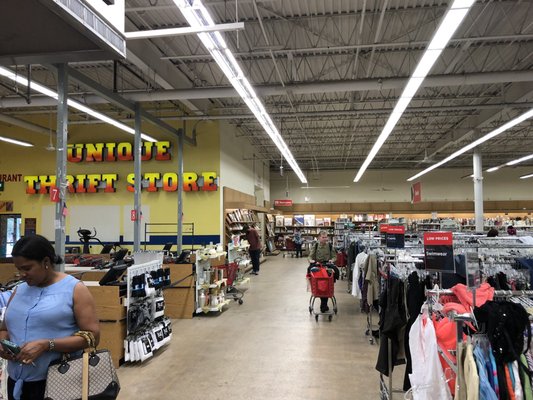
Locate an element on the screen. white wall is located at coordinates (242, 166), (405, 181).